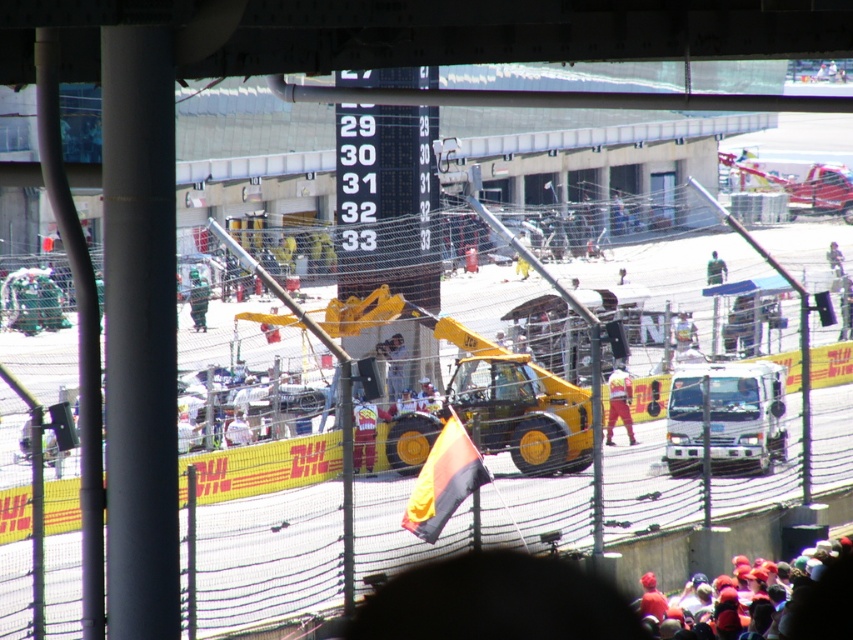
Does red fabric crowd at lower right appear on the left side of white fabric shirt at center?

Incorrect, red fabric crowd at lower right is not on the left side of white fabric shirt at center.

Can you confirm if red fabric crowd at lower right is thinner than white fabric shirt at center?

In fact, red fabric crowd at lower right might be wider than white fabric shirt at center.

The height and width of the screenshot is (640, 853). I want to click on red fabric crowd at lower right, so click(820, 600).

Is point (403, 355) in front of point (192, 285)?

No, (403, 355) is behind (192, 285).

Can you confirm if yellow rubber boot at center is positioned above green fabric person at center?

No.

Is point (389, 356) positioned in front of point (202, 280)?

That is False.

Where is `yellow rubber boot at center`? yellow rubber boot at center is located at coordinates (396, 365).

Is green fabric person at center bigger than dark blue uniform at upper right?

Actually, green fabric person at center might be smaller than dark blue uniform at upper right.

At what (x,y) coordinates should I click in order to perform the action: click on green fabric person at center. Please return your answer as a coordinate pair (x, y). This screenshot has width=853, height=640. Looking at the image, I should click on (198, 300).

Find the location of a particular element. The height and width of the screenshot is (640, 853). green fabric person at center is located at coordinates (198, 300).